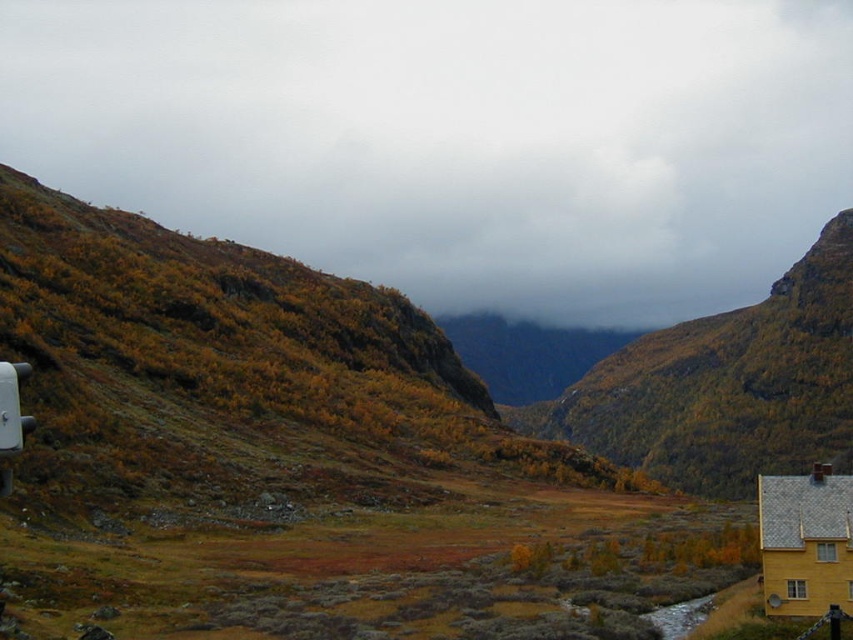
Question: Considering the relative positions of cloudy gray sky at upper center and white plastic recreational vehicle at left in the image provided, where is cloudy gray sky at upper center located with respect to white plastic recreational vehicle at left?

Choices:
 (A) above
 (B) below

Answer: (A)

Question: Considering the real-world distances, which object is farthest from the yellow wooden house at lower right?

Choices:
 (A) cloudy gray sky at upper center
 (B) white plastic recreational vehicle at left

Answer: (A)

Question: Can you confirm if cloudy gray sky at upper center is bigger than yellow wooden house at lower right?

Choices:
 (A) no
 (B) yes

Answer: (B)

Question: Which object is positioned closest to the cloudy gray sky at upper center?

Choices:
 (A) white plastic recreational vehicle at left
 (B) yellow wooden house at lower right

Answer: (B)

Question: Which point is closer to the camera taking this photo?

Choices:
 (A) (782, 518)
 (B) (6, 401)

Answer: (B)

Question: Does cloudy gray sky at upper center appear on the left side of white plastic recreational vehicle at left?

Choices:
 (A) no
 (B) yes

Answer: (B)